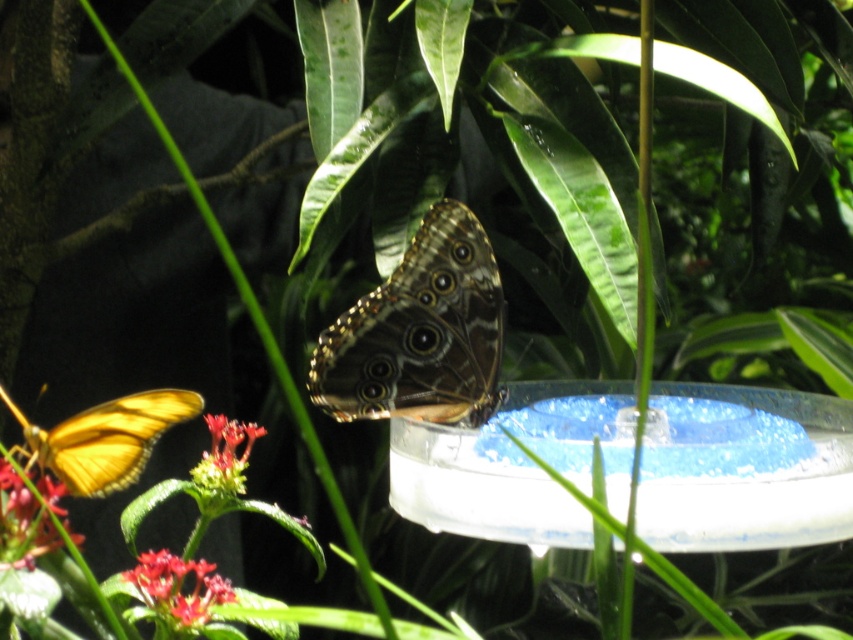
Is smooth red petals at lower left to the left of smooth yellow flower at lower left from the viewer's perspective?

In fact, smooth red petals at lower left is to the right of smooth yellow flower at lower left.

Can you confirm if smooth red petals at lower left is smaller than smooth yellow flower at lower left?

Correct, smooth red petals at lower left occupies less space than smooth yellow flower at lower left.

Which is in front, point (149, 593) or point (38, 554)?

Point (38, 554) is in front.

Locate an element on the screen. smooth red petals at lower left is located at coordinates [x=178, y=589].

Does brown textured butterfly at center have a lesser height compared to smooth yellow flower at lower left?

Incorrect, brown textured butterfly at center's height does not fall short of smooth yellow flower at lower left's.

Between brown textured butterfly at center and smooth yellow flower at lower left, which one has more height?

brown textured butterfly at center

Which is in front, point (316, 381) or point (22, 540)?

Point (22, 540) is in front.

Identify the location of brown textured butterfly at center. (421, 332).

Does smooth yellow flower at lower left appear over smooth red flower at lower left?

No, smooth yellow flower at lower left is not above smooth red flower at lower left.

Is point (53, 540) closer to viewer compared to point (230, 436)?

Yes, it is in front of point (230, 436).

Image resolution: width=853 pixels, height=640 pixels. Describe the element at coordinates (22, 522) in the screenshot. I see `smooth yellow flower at lower left` at that location.

Find the location of a particular element. Image resolution: width=853 pixels, height=640 pixels. smooth yellow flower at lower left is located at coordinates pyautogui.click(x=22, y=522).